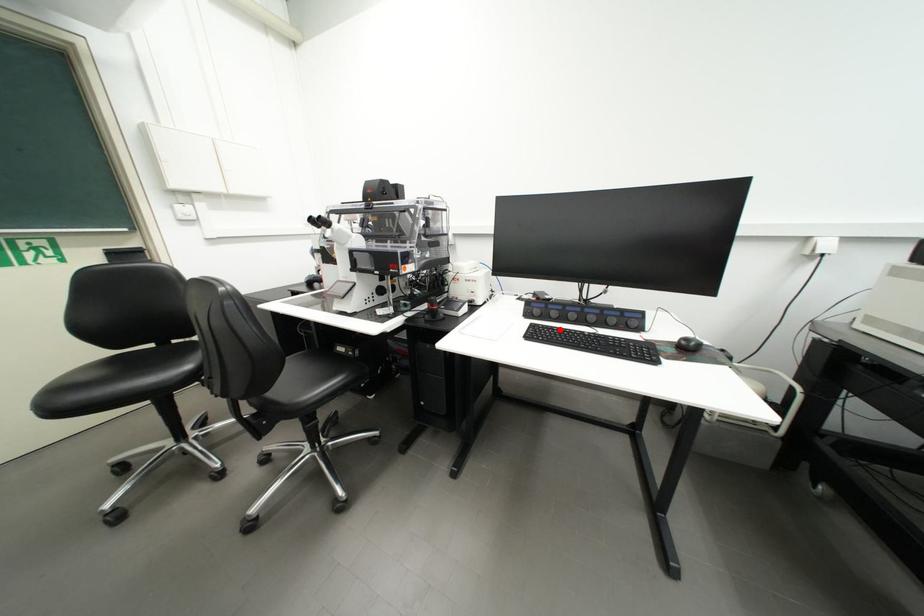
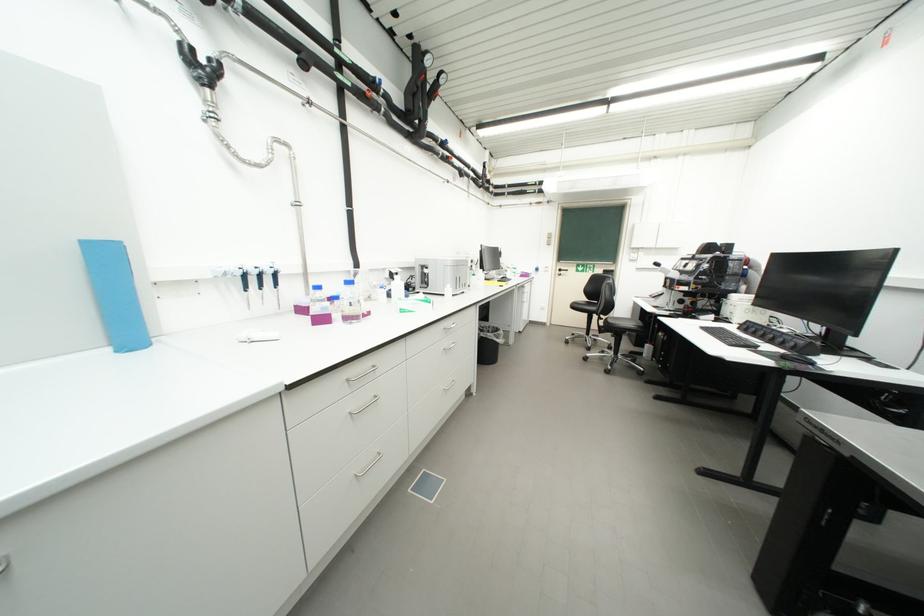
Where in the second image is the point corresponding to the highlighted location from the first image?

(734, 331)